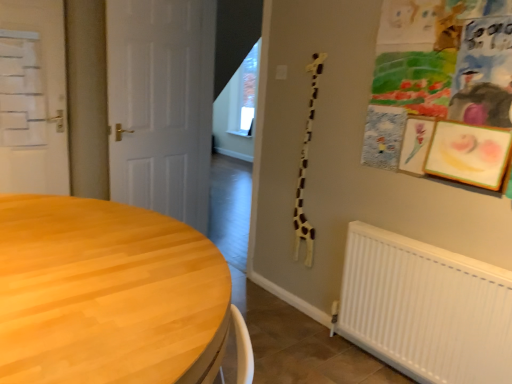
Question: Does point (9, 367) appear closer or farther from the camera than point (183, 122)?

Choices:
 (A) closer
 (B) farther

Answer: (A)

Question: In the image, is wooden table at lower left on the left side or the right side of white matte door at center, marked as the 1th door in a right-to-left arrangement?

Choices:
 (A) right
 (B) left

Answer: (A)

Question: Based on their relative distances, which object is farther from the white matte door at center, the 2th door viewed from the left?

Choices:
 (A) white matte door at left, which ranks as the first door in left-to-right order
 (B) wooden table at lower left

Answer: (B)

Question: Which object is positioned farthest from the wooden table at lower left?

Choices:
 (A) white matte door at left, which ranks as the first door in left-to-right order
 (B) white matte door at center, the 2th door viewed from the left

Answer: (A)